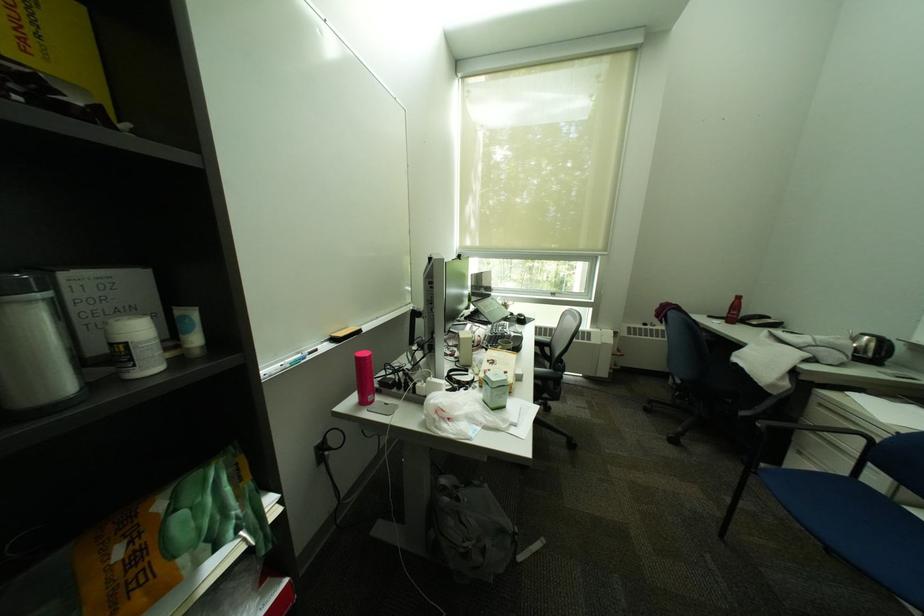
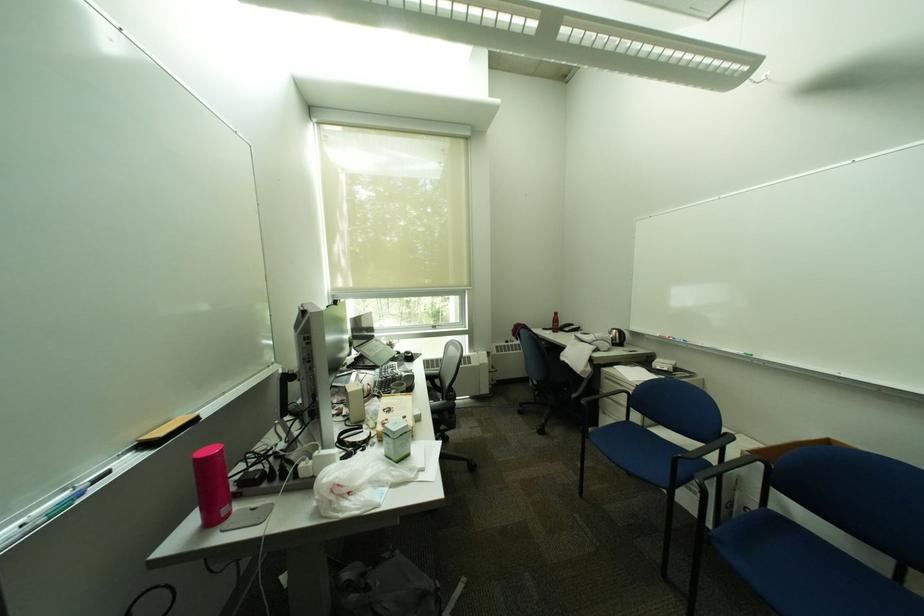
Where in the second image is the point corresponding to point (365, 360) from the first image?

(202, 464)